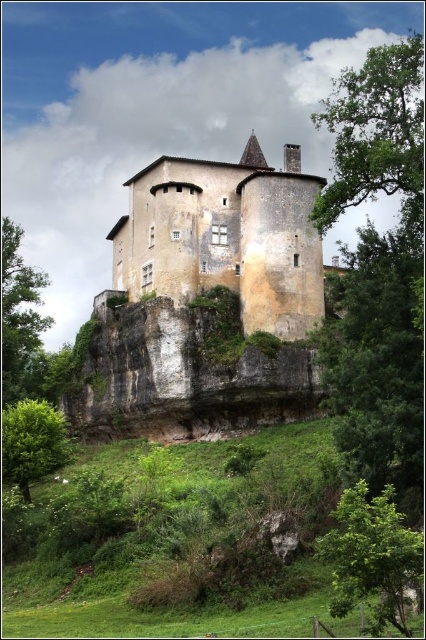
Question: In this image, where is green leafy tree at center located relative to green leafy tree at upper right?

Choices:
 (A) right
 (B) left

Answer: (B)

Question: Does yellowish stone castle at center have a greater width compared to green leafy tree at left?

Choices:
 (A) yes
 (B) no

Answer: (A)

Question: Which object is closer to the camera taking this photo?

Choices:
 (A) green leafy tree at left
 (B) yellowish stone castle at center

Answer: (B)

Question: Among these objects, which one is farthest from the camera?

Choices:
 (A) yellowish stone castle at center
 (B) green leafy tree at left
 (C) green leafy tree at lower left

Answer: (B)

Question: Is yellowish stone castle at center closer to camera compared to green leafy tree at center?

Choices:
 (A) no
 (B) yes

Answer: (A)

Question: Which object appears closest to the camera in this image?

Choices:
 (A) green leafy tree at center
 (B) green leafy tree at lower left
 (C) green leafy tree at upper right

Answer: (A)